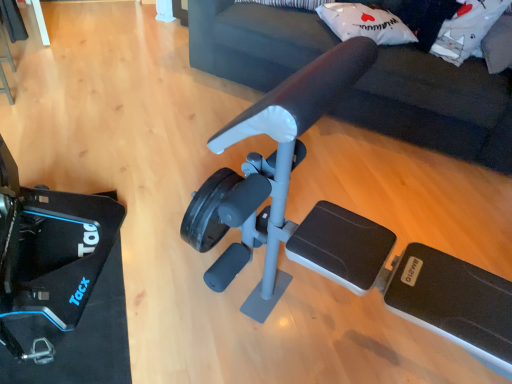
Locate an element on the screen. The height and width of the screenshot is (384, 512). vacant space situated above black matte tacx pedal at lower left (from a real-world perspective) is located at coordinates (52, 270).